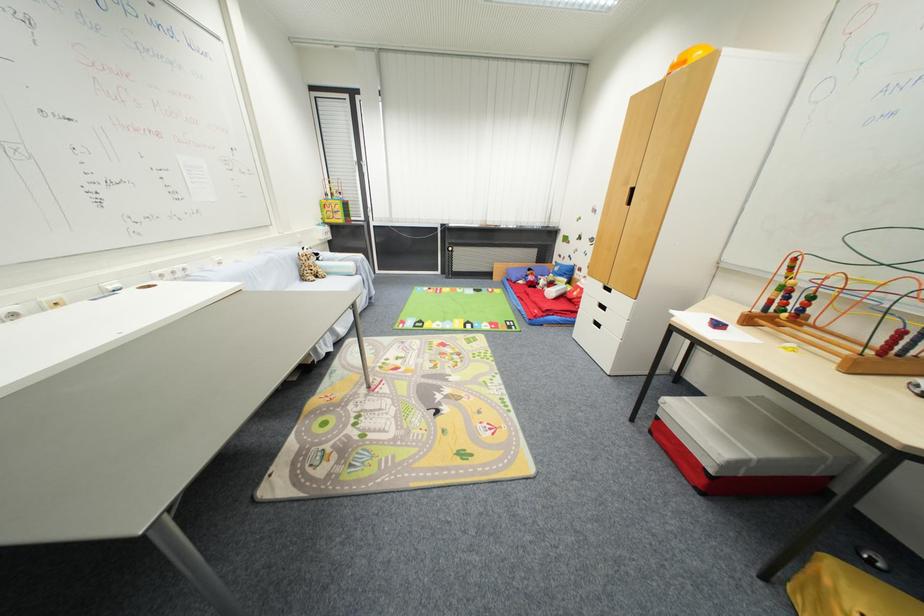
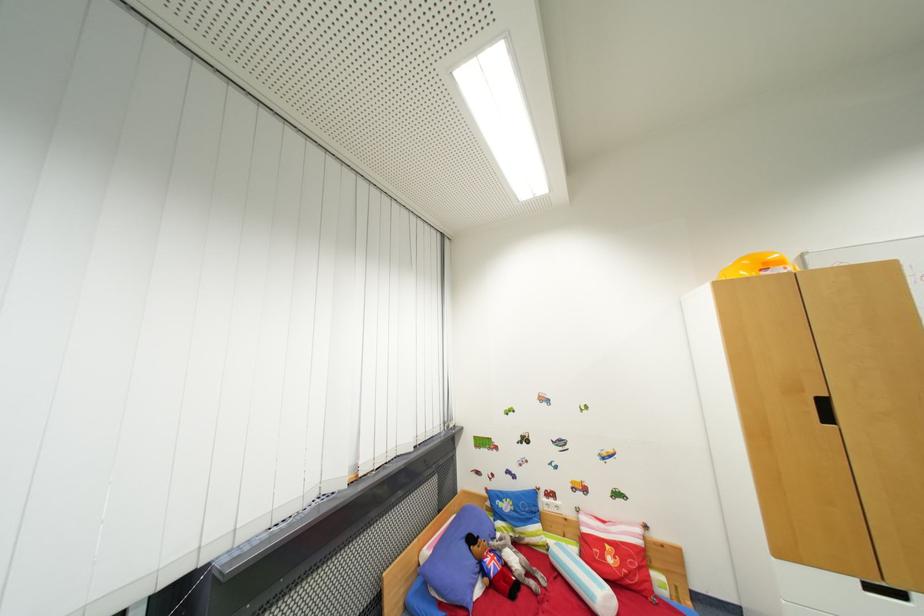
In the second image, find the point that corresponds to point (556, 294) in the first image.

(605, 596)